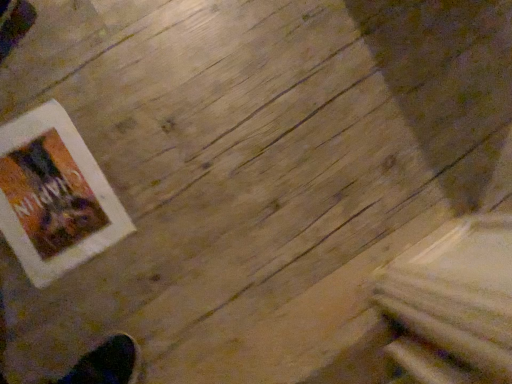
Where is `free area below white matte picture frame at lower left (from a real-world perspective)`? free area below white matte picture frame at lower left (from a real-world perspective) is located at coordinates (50, 190).